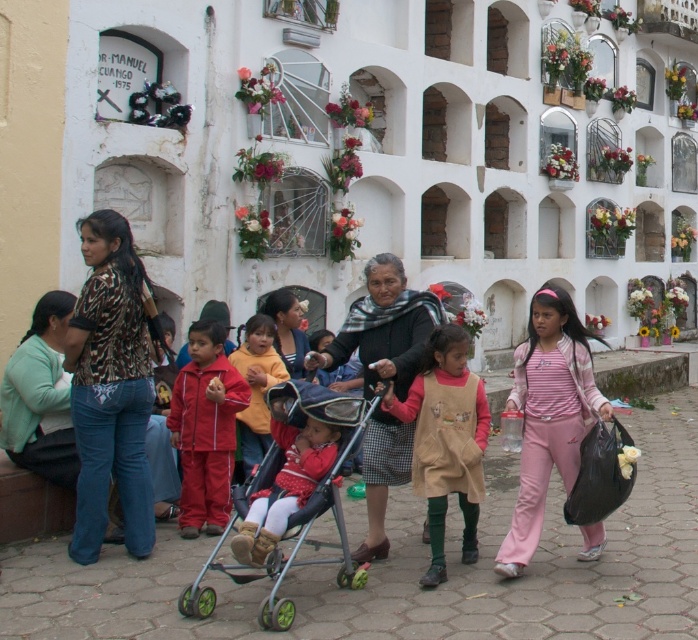
Question: Is green rubber baby carriage at center wider than matte black sweater at center?

Choices:
 (A) no
 (B) yes

Answer: (B)

Question: Is the position of pink matte pants at center more distant than that of black woolen scarf at center?

Choices:
 (A) no
 (B) yes

Answer: (A)

Question: Which point appears farthest from the camera in this image?

Choices:
 (A) (440, 515)
 (B) (297, 317)
 (C) (239, 385)

Answer: (B)

Question: Estimate the real-world distances between objects in this image. Which object is farther from the black woolen scarf at center?

Choices:
 (A) yellow fleece jacket at center
 (B) red track suit at center
 (C) matte black sweater at center

Answer: (C)

Question: Based on their relative distances, which object is farther from the yellow fleece jacket at center?

Choices:
 (A) matte red stroller at center
 (B) pink matte pants at center

Answer: (B)

Question: Is printed fabric blouse at left to the left of pink matte pants at center from the viewer's perspective?

Choices:
 (A) no
 (B) yes

Answer: (B)